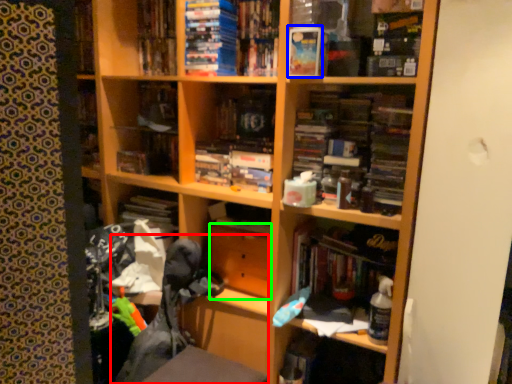
Question: Considering the real-world distances, which object is closest to swivel chair (highlighted by a red box)? paperback book (highlighted by a blue box) or drawer (highlighted by a green box).

Choices:
 (A) paperback book
 (B) drawer

Answer: (B)